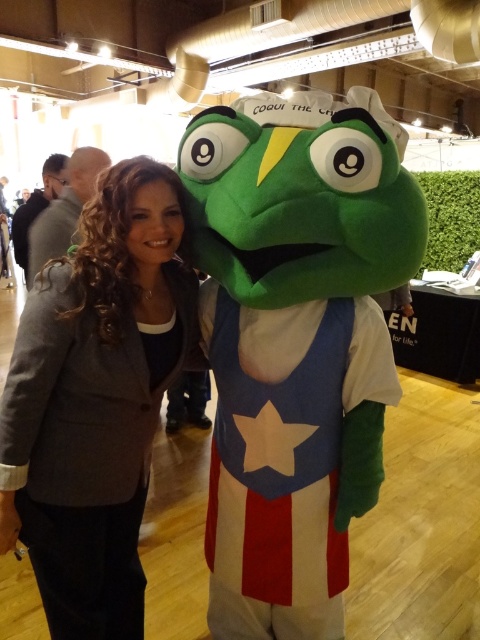
Does matte gray blazer at center have a lesser height compared to velvet green costume at center?

Incorrect, matte gray blazer at center's height does not fall short of velvet green costume at center's.

Does matte gray blazer at center have a greater height compared to velvet green costume at center?

Correct, matte gray blazer at center is much taller as velvet green costume at center.

Which is behind, point (72, 483) or point (344, 531)?

Positioned behind is point (344, 531).

Identify the location of matte gray blazer at center. Image resolution: width=480 pixels, height=640 pixels. (96, 400).